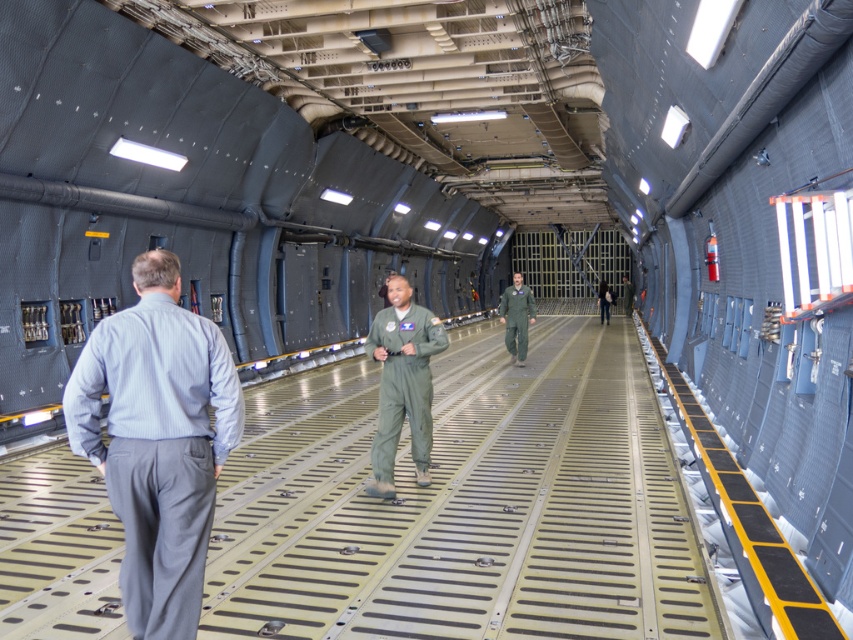
Question: Which point appears closest to the camera in this image?

Choices:
 (A) (419, 388)
 (B) (519, 362)
 (C) (186, 451)

Answer: (C)

Question: Does light blue shirt at left have a greater width compared to green fabric jumpsuit at center?

Choices:
 (A) yes
 (B) no

Answer: (B)

Question: Estimate the real-world distances between objects in this image. Which object is closer to the green fabric jumpsuit at center?

Choices:
 (A) green flight suit at center
 (B) light blue shirt at left

Answer: (B)

Question: Does light blue shirt at left have a smaller size compared to green fabric jumpsuit at center?

Choices:
 (A) yes
 (B) no

Answer: (A)

Question: Can you confirm if light blue shirt at left is smaller than green flight suit at center?

Choices:
 (A) no
 (B) yes

Answer: (B)

Question: Which object is the farthest from the light blue shirt at left?

Choices:
 (A) green fabric jumpsuit at center
 (B) green flight suit at center

Answer: (B)